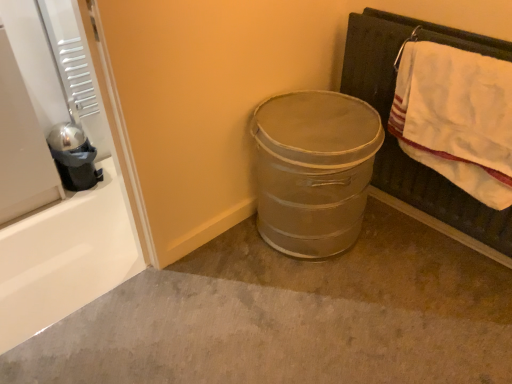
Question: From a real-world perspective, is white cotton towel at upper right physically located above or below shiny metallic pot at left?

Choices:
 (A) below
 (B) above

Answer: (B)

Question: Which is correct: white cotton towel at upper right is inside shiny metallic pot at left, or outside of it?

Choices:
 (A) inside
 (B) outside

Answer: (B)

Question: Considering the real-world distances, which object is closest to the metallic gray trash can at center?

Choices:
 (A) white cotton towel at upper right
 (B) shiny metallic pot at left
 (C) metallic gray trash can at center

Answer: (C)

Question: Which object is the farthest from the metallic gray trash can at center?

Choices:
 (A) white cotton towel at upper right
 (B) shiny metallic pot at left
 (C) metallic gray trash can at center

Answer: (B)